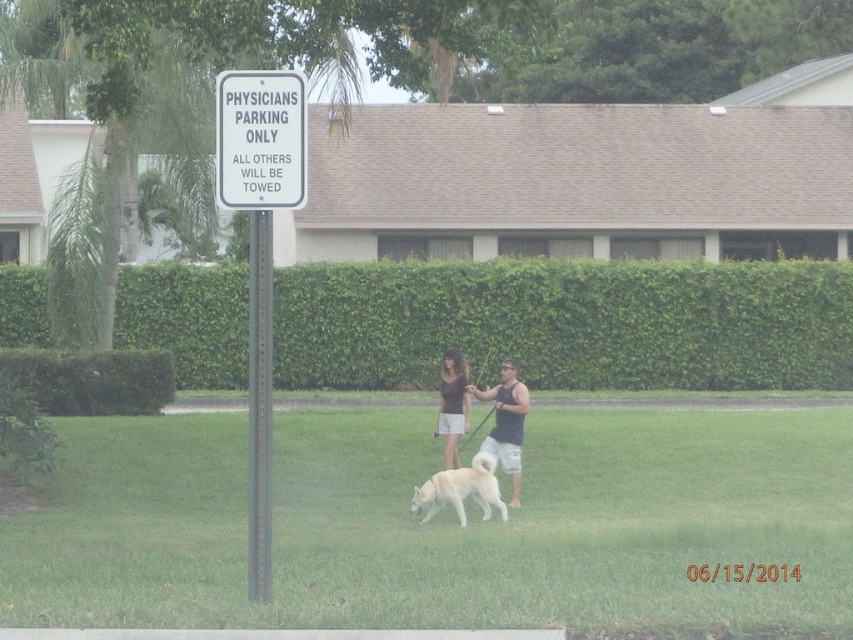
Which of these two, white plastic sign at upper center or matte brown hair at center, stands taller?

Standing taller between the two is matte brown hair at center.

Between point (244, 147) and point (517, 445), which one is positioned behind?

The point (517, 445) is more distant.

What do you see at coordinates (260, 140) in the screenshot? I see `white plastic sign at upper center` at bounding box center [260, 140].

This screenshot has height=640, width=853. Find the location of `white plastic sign at upper center`. white plastic sign at upper center is located at coordinates (260, 140).

Does white plastic sign at upper center appear over white fur dog at center?

Correct, white plastic sign at upper center is located above white fur dog at center.

Between white plastic sign at upper center and white fur dog at center, which one appears on the left side from the viewer's perspective?

From the viewer's perspective, white plastic sign at upper center appears more on the left side.

Which is behind, point (253, 129) or point (433, 504)?

The point (433, 504) is more distant.

This screenshot has height=640, width=853. In order to click on white plastic sign at upper center in this screenshot , I will do `click(260, 140)`.

Can you confirm if green leafy hedge at center is positioned below metallic pole at center?

No, green leafy hedge at center is not below metallic pole at center.

Can you confirm if green leafy hedge at center is wider than metallic pole at center?

Indeed, green leafy hedge at center has a greater width compared to metallic pole at center.

Is point (408, 380) farther from camera compared to point (270, 460)?

Yes, point (408, 380) is farther from viewer.

Locate an element on the screen. green leafy hedge at center is located at coordinates (567, 323).